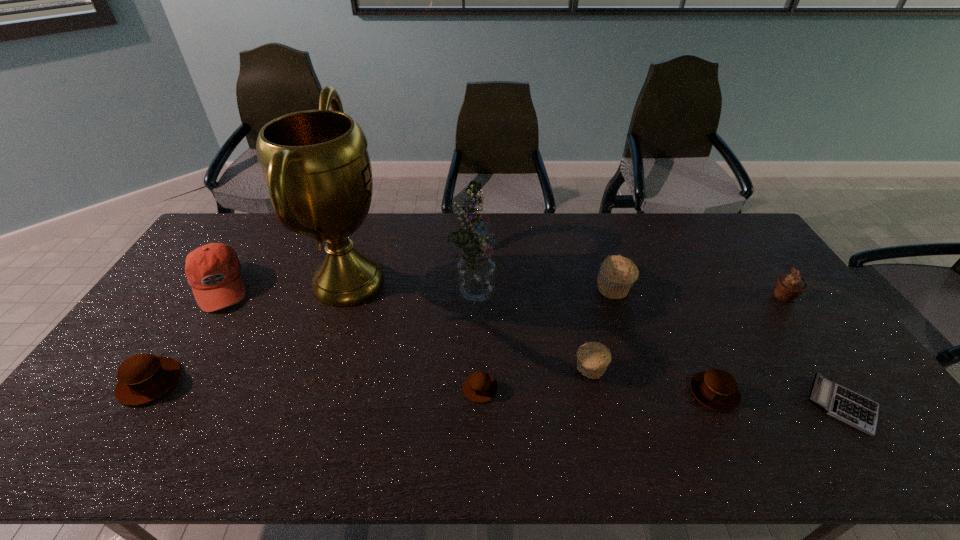
Image resolution: width=960 pixels, height=540 pixels. Find the location of `the third object from left to right`. the third object from left to right is located at coordinates (316, 165).

Locate an element on the screen. The width and height of the screenshot is (960, 540). trophy cup is located at coordinates (316, 165).

At what (x,y) coordinates should I click in order to perform the action: click on green bouquet. Please return your answer as a coordinate pair (x, y). The width and height of the screenshot is (960, 540). Looking at the image, I should click on (476, 271).

At what (x,y) coordinates should I click in order to perform the action: click on the ninth shortest object. Please return your answer as a coordinate pair (x, y). The image size is (960, 540). Looking at the image, I should click on (476, 271).

In order to click on baseball cap in this screenshot , I will do `click(213, 270)`.

Where is `the fourth muffin from left to right`? the fourth muffin from left to right is located at coordinates (617, 274).

The image size is (960, 540). In order to click on the bigger beige muffin in this screenshot , I will do `click(617, 274)`.

The image size is (960, 540). What are the coordinates of `the rightmost muffin` in the screenshot? It's located at (789, 286).

You are a GUI agent. You are given a task and a screenshot of the screen. Output one action in this format:
    pyautogui.click(x=<x>, y=<y>)
    Task: Click on the nearer beige muffin
    
    Given the screenshot: What is the action you would take?
    pyautogui.click(x=593, y=358)

Identify the location of the smaller beige muffin. Image resolution: width=960 pixels, height=540 pixels. (593, 358).